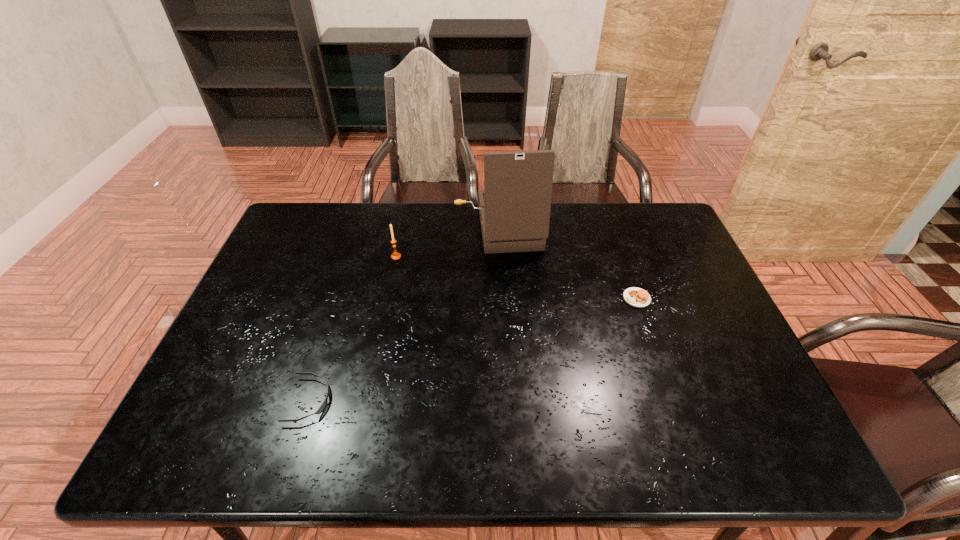
Where is `the second object from right to left`? The width and height of the screenshot is (960, 540). the second object from right to left is located at coordinates [514, 207].

You are a GUI agent. You are given a task and a screenshot of the screen. Output one action in this format:
    pyautogui.click(x=<x>, y=<y>)
    Task: Click on the tallest object
    
    Given the screenshot: What is the action you would take?
    pyautogui.click(x=514, y=207)

Find the location of `the third object from right to left`. the third object from right to left is located at coordinates (395, 255).

In order to click on candle_holder in this screenshot , I will do `click(395, 255)`.

Where is `the rightmost object`? Image resolution: width=960 pixels, height=540 pixels. the rightmost object is located at coordinates (636, 297).

Where is `the third tallest object`? the third tallest object is located at coordinates (636, 297).

Image resolution: width=960 pixels, height=540 pixels. What are the coordinates of `the shortest object` in the screenshot? It's located at (325, 402).

This screenshot has height=540, width=960. What are the coordinates of `the leftmost object` in the screenshot? It's located at (325, 402).

Where is `free space located on the front of the phonograph record`? The height and width of the screenshot is (540, 960). free space located on the front of the phonograph record is located at coordinates (500, 280).

Find the location of a particular element. Image resolution: width=960 pixels, height=540 pixels. vacant position located on the back of the second object from left to right is located at coordinates (406, 208).